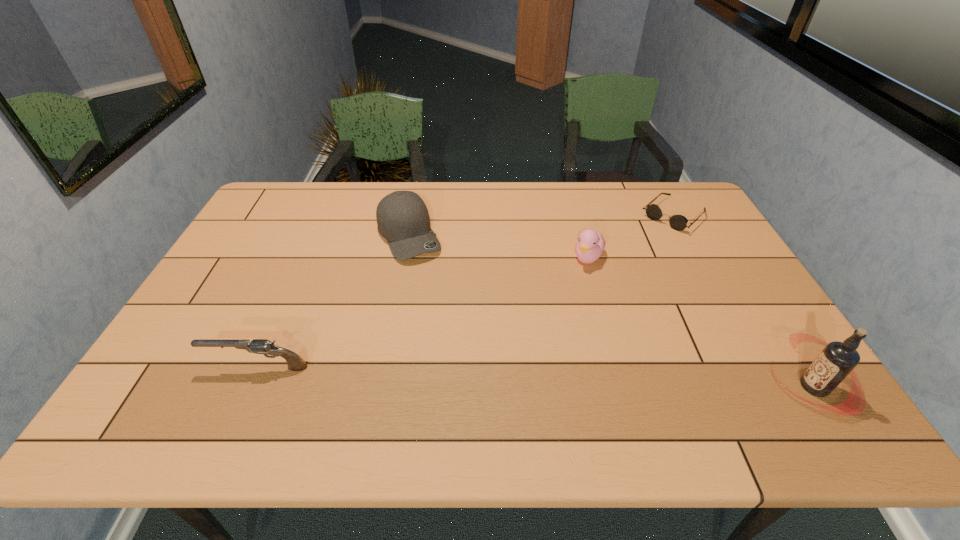
Find the location of a particular element. The image size is (960, 540). object situated at the near right corner is located at coordinates (838, 359).

At what (x,y) coordinates should I click in order to perform the action: click on free space at the far edge of the desktop. Please return your answer as a coordinate pair (x, y). The height and width of the screenshot is (540, 960). Looking at the image, I should click on (503, 193).

In the image, there is a desktop. Identify the location of vacant space at the near edge. (500, 372).

In the image, there is a desktop. Identify the location of vacant space at the left edge. The height and width of the screenshot is (540, 960). (294, 221).

This screenshot has width=960, height=540. In the image, there is a desktop. Find the location of `vacant space at the right edge`. vacant space at the right edge is located at coordinates (767, 340).

In order to click on vacant space at the far left corner of the desktop in this screenshot , I will do `click(306, 192)`.

Where is `free region at the far right corner of the desktop`? The width and height of the screenshot is (960, 540). free region at the far right corner of the desktop is located at coordinates (668, 187).

Where is `empty location between the tallest object and the shortest object`? empty location between the tallest object and the shortest object is located at coordinates (744, 301).

Image resolution: width=960 pixels, height=540 pixels. I want to click on free point between the fourth object from right to left and the sunglasses, so click(541, 225).

Locate an element on the screen. The width and height of the screenshot is (960, 540). vacant area that lies between the gun and the root beer is located at coordinates (536, 377).